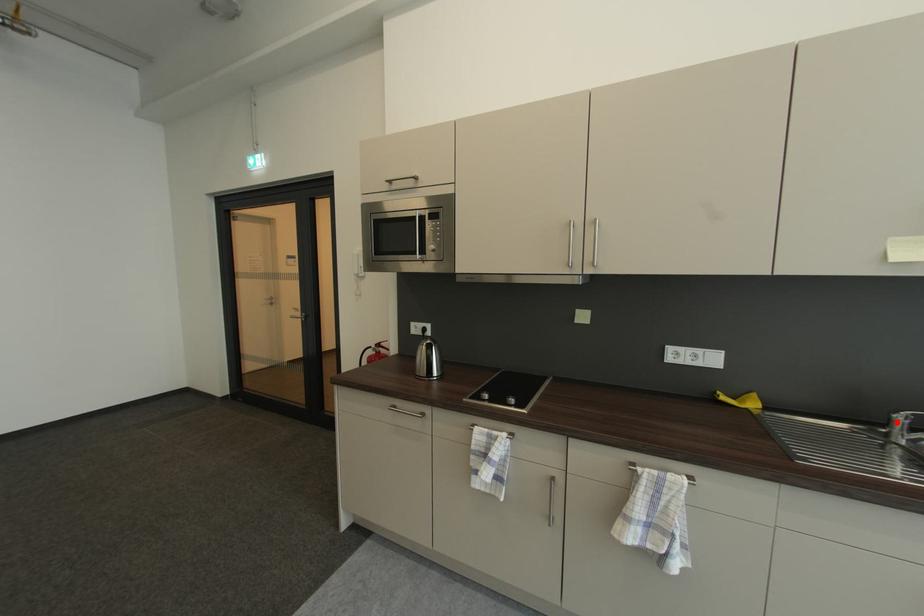
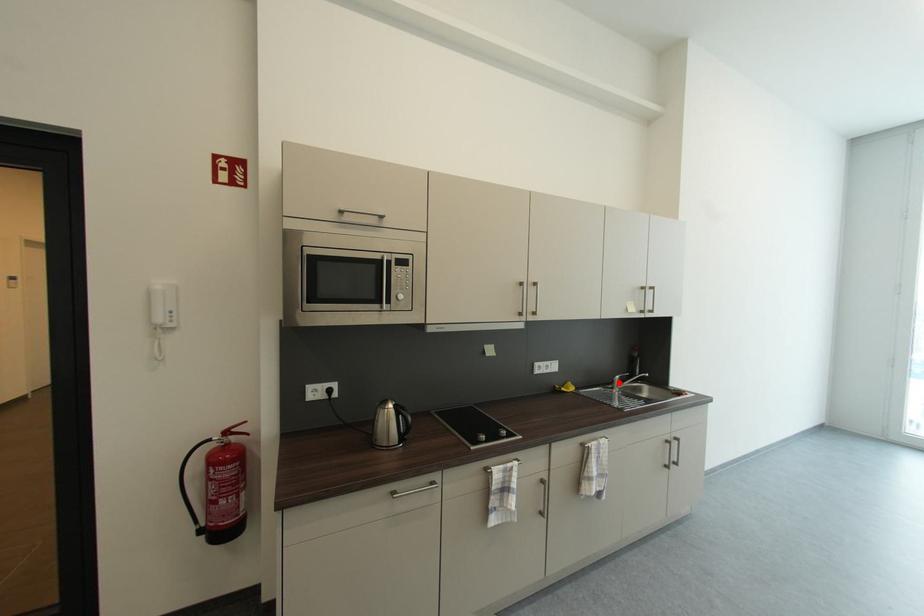
I am providing you with two images of the same scene from different viewpoints. A red point is marked on the first image and another point is marked on the second image. Is the red point in image1 aligned with the point shown in image2?

Yes